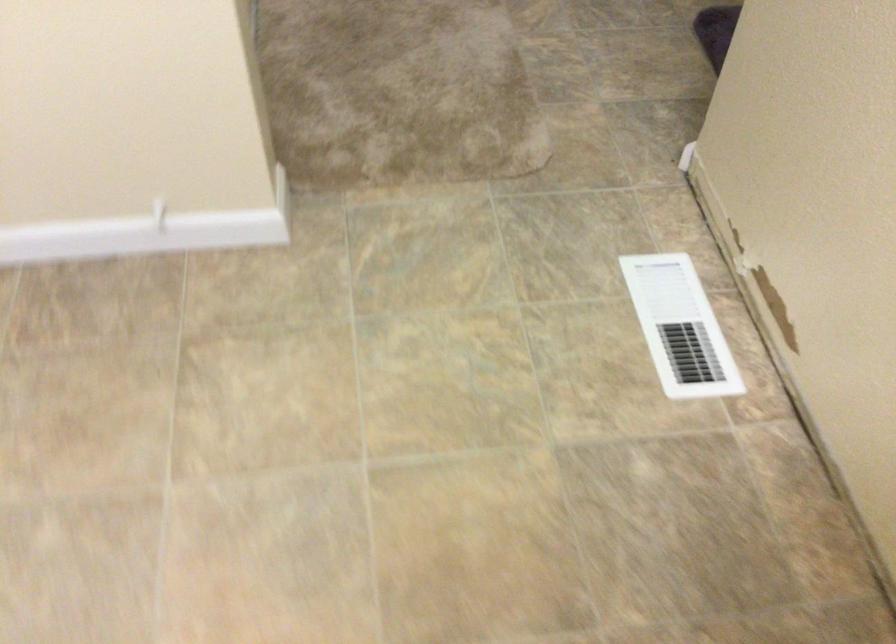
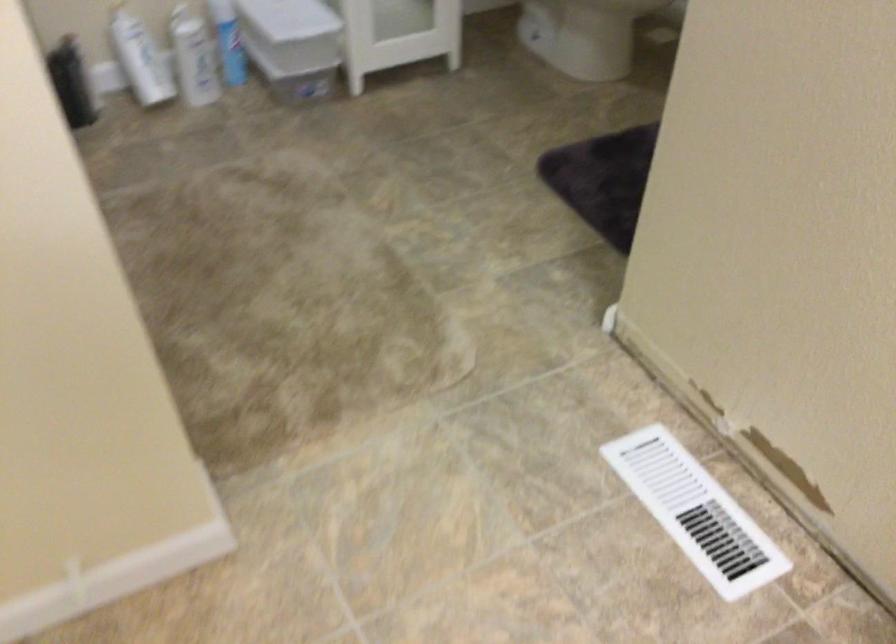
The point at (682, 328) is marked in the first image. Where is the corresponding point in the second image?

(695, 512)